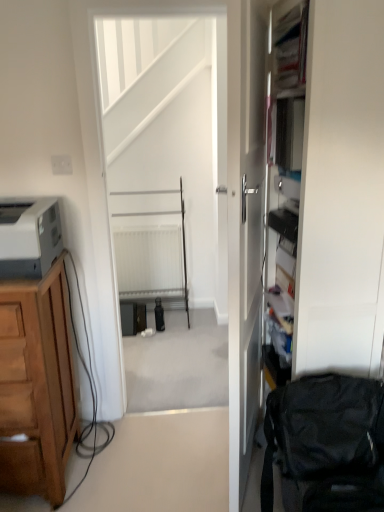
Locate an element on the screen. The image size is (384, 512). free space above white plastic radiator at center (from a real-world perspective) is located at coordinates (153, 226).